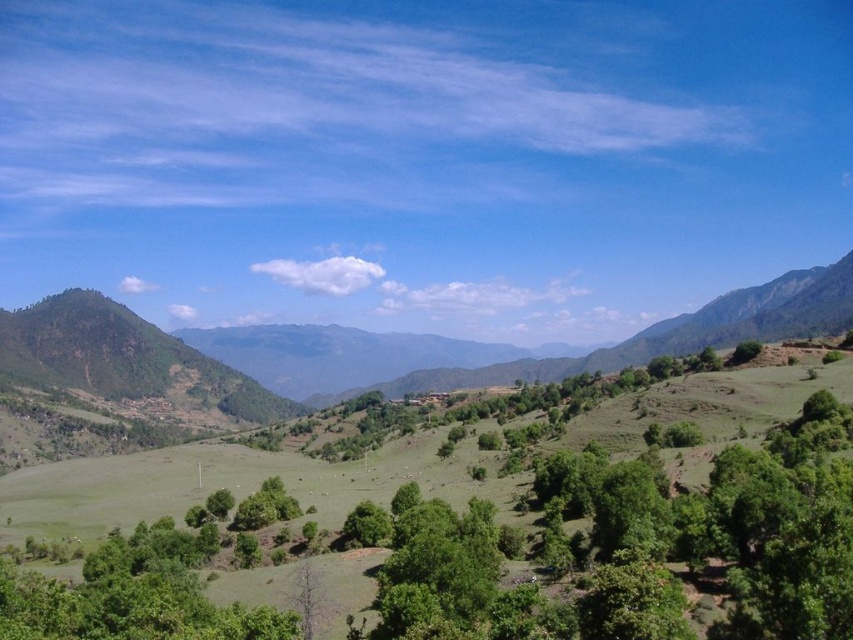
Question: Which point is farther to the camera?

Choices:
 (A) (9, 326)
 (B) (223, 499)

Answer: (A)

Question: Can you confirm if green grassy hillside at left is positioned to the left of green leafy tree at center?

Choices:
 (A) no
 (B) yes

Answer: (A)

Question: Among these points, which one is nearest to the camera?

Choices:
 (A) (222, 492)
 (B) (206, 364)

Answer: (A)

Question: In this image, where is green grassy hillside at left located relative to green leafy tree at center?

Choices:
 (A) above
 (B) below

Answer: (A)

Question: Does green grassy hillside at left appear on the left side of green leafy tree at center?

Choices:
 (A) yes
 (B) no

Answer: (B)